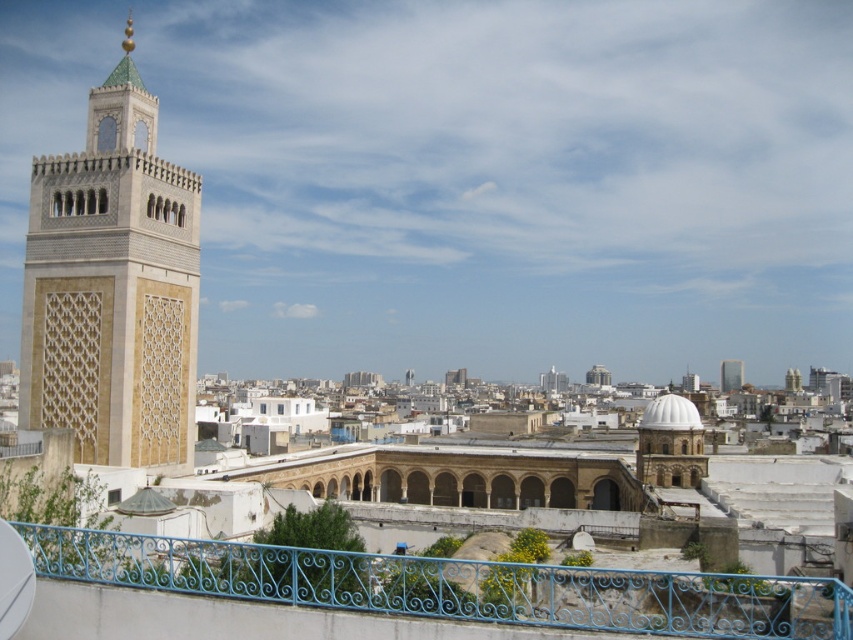
Can you confirm if blue wrought iron railing at lower center is shorter than glassy reflective skyscraper at center?

In fact, blue wrought iron railing at lower center may be taller than glassy reflective skyscraper at center.

Between blue wrought iron railing at lower center and glassy reflective skyscraper at center, which one has more height?

blue wrought iron railing at lower center

Which is in front, point (576, 568) or point (741, 364)?

Point (576, 568) is more forward.

Locate an element on the screen. Image resolution: width=853 pixels, height=640 pixels. blue wrought iron railing at lower center is located at coordinates (451, 586).

Can you confirm if beige stone tower at left is shorter than glassy reflective skyscraper at center?

In fact, beige stone tower at left may be taller than glassy reflective skyscraper at center.

Is point (158, 360) closer to viewer compared to point (723, 385)?

Yes, it is in front of point (723, 385).

Which is behind, point (103, 323) or point (735, 385)?

Positioned behind is point (735, 385).

You are a GUI agent. You are given a task and a screenshot of the screen. Output one action in this format:
    pyautogui.click(x=<x>, y=<y>)
    Task: Click on the beige stone tower at left
    The width and height of the screenshot is (853, 640).
    Given the screenshot: What is the action you would take?
    pyautogui.click(x=113, y=288)

Is beige stone tower at left below blue wrought iron railing at lower center?

Actually, beige stone tower at left is above blue wrought iron railing at lower center.

Can you confirm if beige stone tower at left is positioned to the left of blue wrought iron railing at lower center?

Correct, you'll find beige stone tower at left to the left of blue wrought iron railing at lower center.

What do you see at coordinates (113, 288) in the screenshot? I see `beige stone tower at left` at bounding box center [113, 288].

Locate an element on the screen. beige stone tower at left is located at coordinates (113, 288).